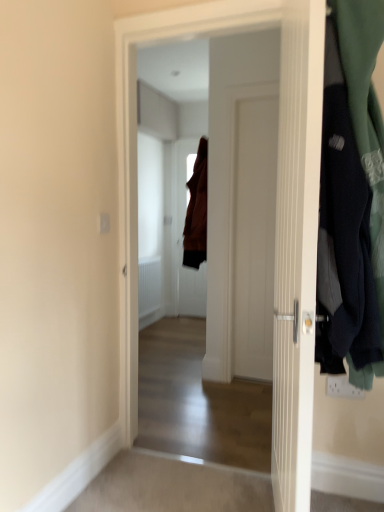
Question: Considering the positions of point (309, 361) and point (312, 272), is point (309, 361) closer or farther from the camera than point (312, 272)?

Choices:
 (A) farther
 (B) closer

Answer: (A)

Question: Would you say white wooden door at center, the 2th door positioned from the back, is inside or outside white wooden door at center, acting as the 1th door starting from the front?

Choices:
 (A) inside
 (B) outside

Answer: (B)

Question: Which object is the closest to the white wooden door at center, acting as the 1th door starting from the front?

Choices:
 (A) white wooden door at center, arranged as the second door when viewed from the front
 (B) dark blue fabric at right
 (C) brown fabric door at center, which appears as the 3th door when viewed from the front

Answer: (A)

Question: Which object is the farthest from the white wooden door at center, the 2th door positioned from the back?

Choices:
 (A) dark blue fabric at right
 (B) brown fabric door at center, which appears as the 3th door when viewed from the front
 (C) white wooden door at center, which appears as the 3th door when viewed from the back

Answer: (B)